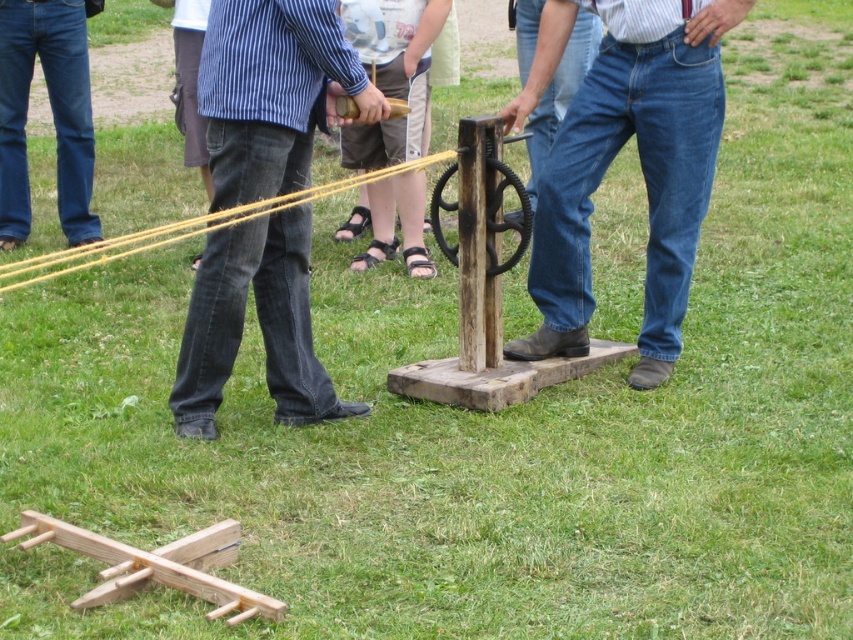
Question: Considering the relative positions of blue jeans at center and blue jeans at left in the image provided, where is blue jeans at center located with respect to blue jeans at left?

Choices:
 (A) below
 (B) above

Answer: (A)

Question: Considering the relative positions of denim jeans at left and blue jeans at center in the image provided, where is denim jeans at left located with respect to blue jeans at center?

Choices:
 (A) below
 (B) above

Answer: (A)

Question: Which point is closer to the camera?

Choices:
 (A) denim jeans at left
 (B) blue jeans at left
 (C) blue jeans at center

Answer: (A)

Question: Which of the following is the closest to the observer?

Choices:
 (A) denim jeans at left
 (B) blue jeans at center

Answer: (A)

Question: Does blue jeans at center appear over blue jeans at left?

Choices:
 (A) no
 (B) yes

Answer: (A)

Question: Which is nearer to the denim jeans at left?

Choices:
 (A) blue jeans at center
 (B) blue jeans at left

Answer: (A)